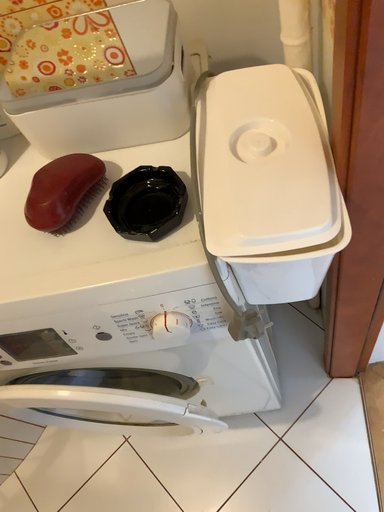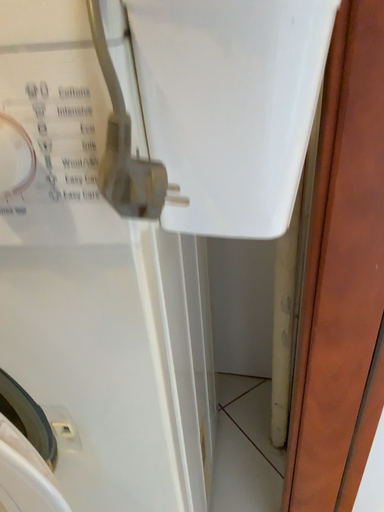
Question: Which way did the camera rotate in the video?

Choices:
 (A) rotated downward
 (B) rotated upward

Answer: (B)